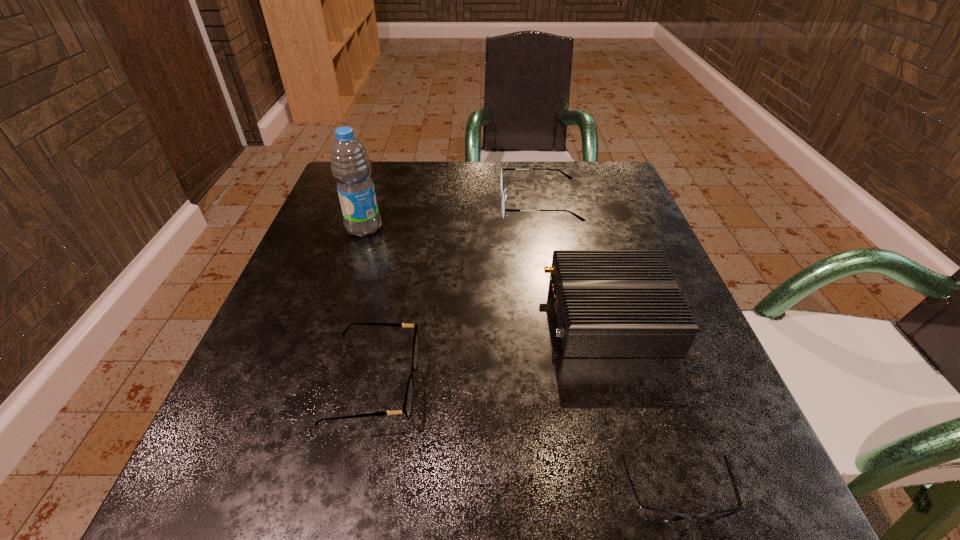
Where is `vacant space that's between the router and the leftmost spectacles`? vacant space that's between the router and the leftmost spectacles is located at coordinates (492, 349).

Identify the location of unoccupied area between the nearest spectacles and the water bottle. This screenshot has width=960, height=540. [519, 363].

Where is `unoccupied area between the water bottle and the router`? The width and height of the screenshot is (960, 540). unoccupied area between the water bottle and the router is located at coordinates (487, 271).

Find the location of a particular element. Image resolution: width=960 pixels, height=540 pixels. vacant space that is in between the router and the nearest object is located at coordinates click(x=642, y=407).

Find the location of a particular element. This screenshot has height=540, width=960. vacant space that's between the water bottle and the nearest spectacles is located at coordinates (519, 363).

You are a GUI agent. You are given a task and a screenshot of the screen. Output one action in this format:
    pyautogui.click(x=<x>, y=<y>)
    Task: Click on the object that stands as the closest to the nearest object
    
    Given the screenshot: What is the action you would take?
    pyautogui.click(x=609, y=303)

I want to click on object that is the third closest to the second nearest spectacles, so click(x=350, y=164).

Identify which spectacles is located as the second nearest to the nearest object. Please provide its 2D coordinates. Your answer should be formatted as a tuple, i.e. [(x, y)], where the tuple contains the x and y coordinates of a point satisfying the conditions above.

[(504, 196)]

Locate an element on the screen. spectacles that is the closest to the nearest spectacles is located at coordinates 408,402.